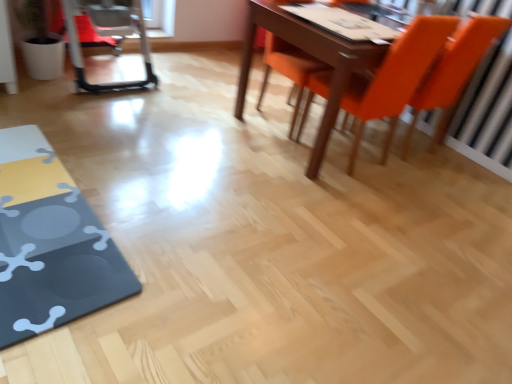
Where is `free area below metallic silver swivel chair at left (from a real-world perspective)`? The height and width of the screenshot is (384, 512). free area below metallic silver swivel chair at left (from a real-world perspective) is located at coordinates (113, 74).